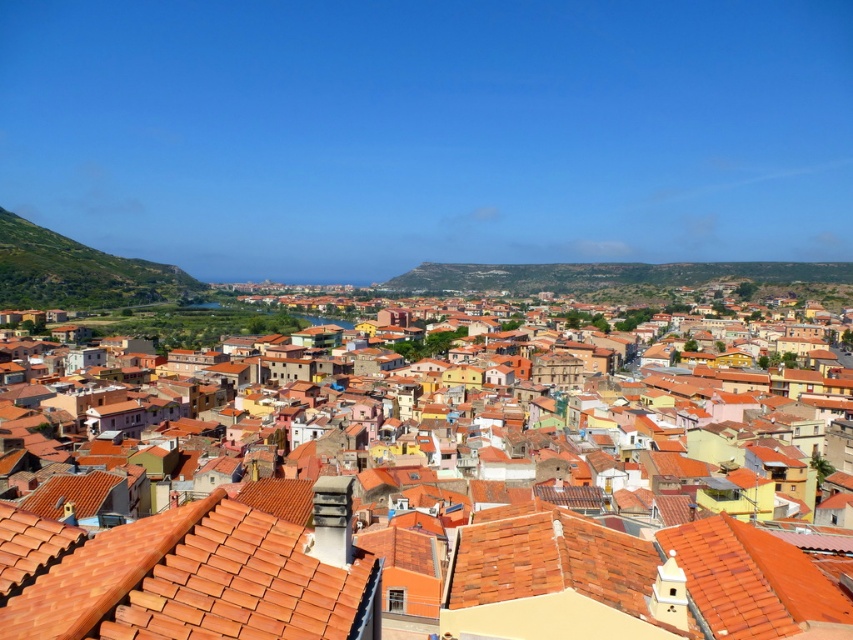
You are a drone operator trying to navigate between two terracotta tiles in the urban area. You see the terracotta tiles at center and the terracotta tiles at lower left. Which one is located to the right when viewed from above?

The terracotta tiles at center is positioned on the right side of terracotta tiles at lower left, so the terracotta tiles at center is located to the right when viewed from above.

You are standing in the town square and want to take a photo of the terracotta tiles at center and the terracotta tiles at lower left. Which set of tiles will appear larger in your photo?

The terracotta tiles at center will appear larger in the photo because they are closer to the viewer than the terracotta tiles at lower left.